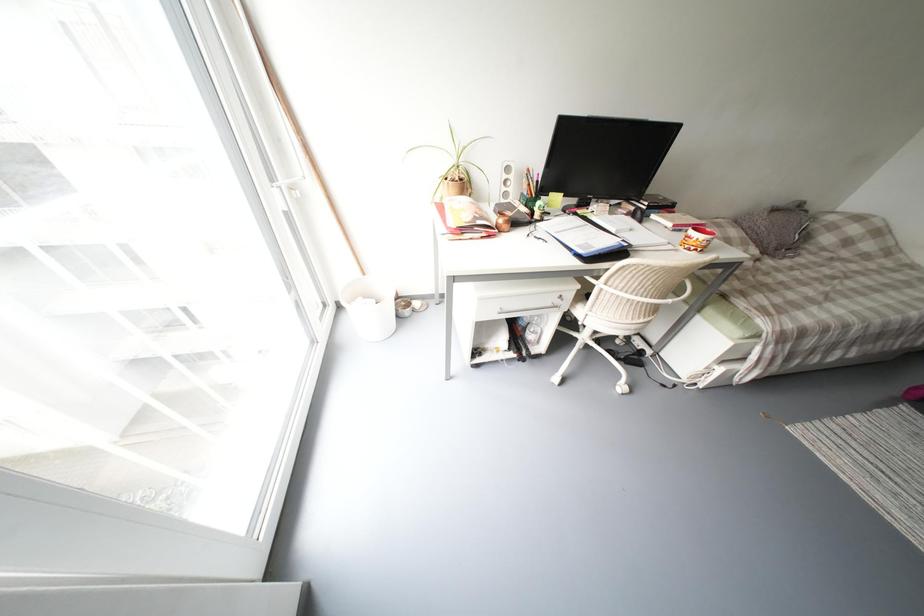
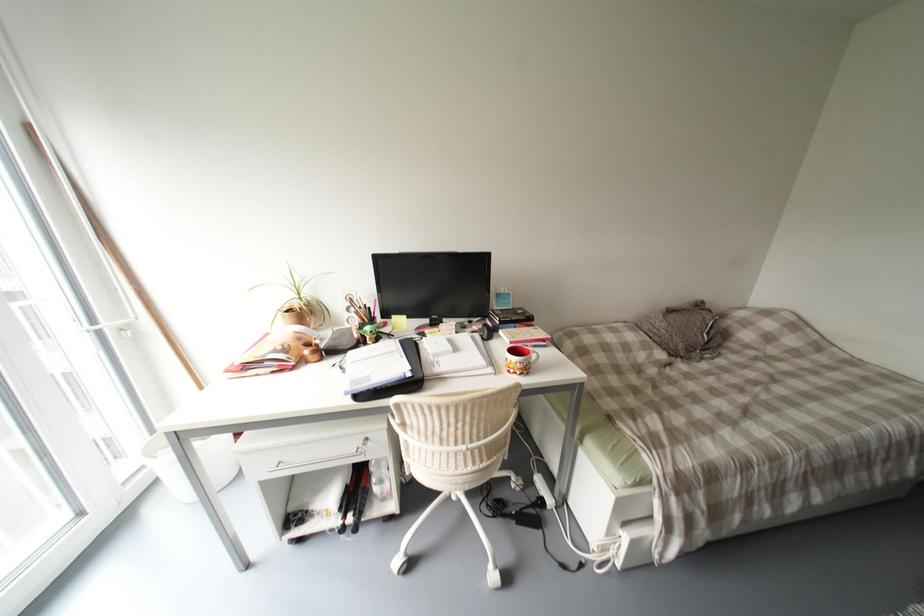
Question: What movement of the cameraman would produce the second image?

Choices:
 (A) Left
 (B) Right
 (C) Forward
 (D) Backward

Answer: (B)